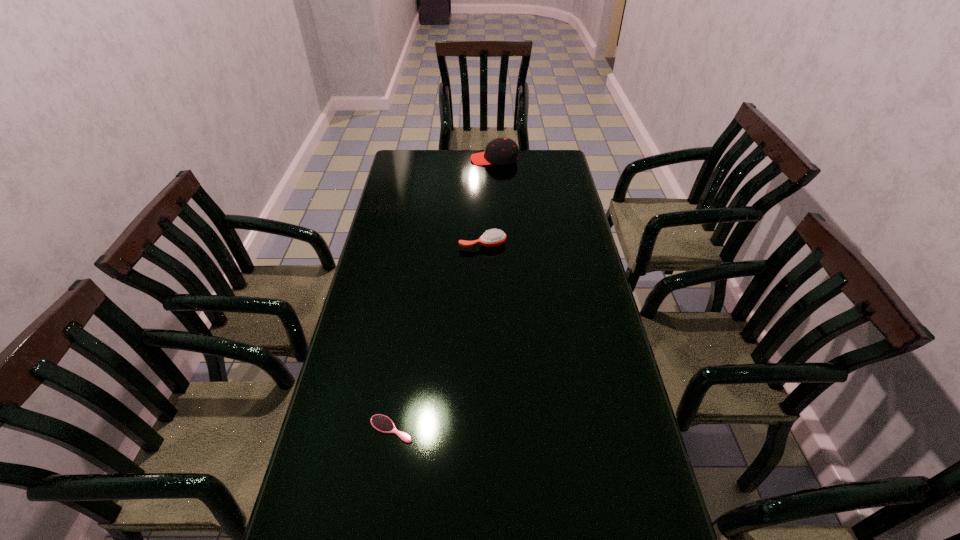
Where is `vacant area situated 0.090m on the left of the shortest object`? vacant area situated 0.090m on the left of the shortest object is located at coordinates (333, 429).

This screenshot has height=540, width=960. Find the location of `object at the far edge`. object at the far edge is located at coordinates (501, 151).

The image size is (960, 540). Identify the location of object that is at the left edge. (382, 423).

This screenshot has height=540, width=960. Identify the location of vacant space at the far edge. (439, 159).

This screenshot has height=540, width=960. Identify the location of vacant space at the left edge of the desktop. (370, 306).

Identify the location of vacant space at the right edge of the desktop. (x=547, y=221).

Where is `blank space at the far left corner of the desktop`? This screenshot has height=540, width=960. blank space at the far left corner of the desktop is located at coordinates (397, 165).

Where is `vacant space at the far right corner`? The image size is (960, 540). vacant space at the far right corner is located at coordinates (569, 171).

You are a GUI agent. You are given a task and a screenshot of the screen. Output one action in this format:
    pyautogui.click(x=<x>, y=<y>)
    Task: Click on the free space between the nearest object and the taller hairbrush
    The height and width of the screenshot is (540, 960).
    Given the screenshot: What is the action you would take?
    pyautogui.click(x=437, y=336)

Locate an element on the screen. free area in between the leftmost object and the cap is located at coordinates (443, 294).